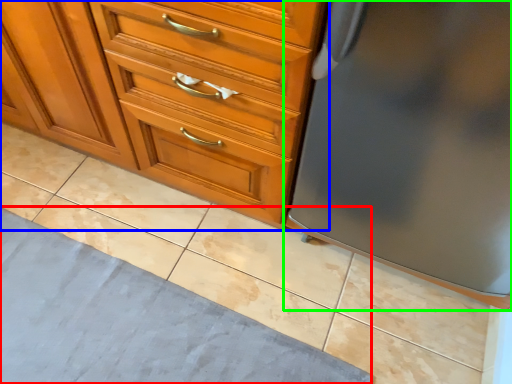
Question: Based on their relative distances, which object is farther from bath mat (highlighted by a red box)? Choose from chest of drawers (highlighted by a blue box) and refrigerator (highlighted by a green box).

Choices:
 (A) chest of drawers
 (B) refrigerator

Answer: (B)